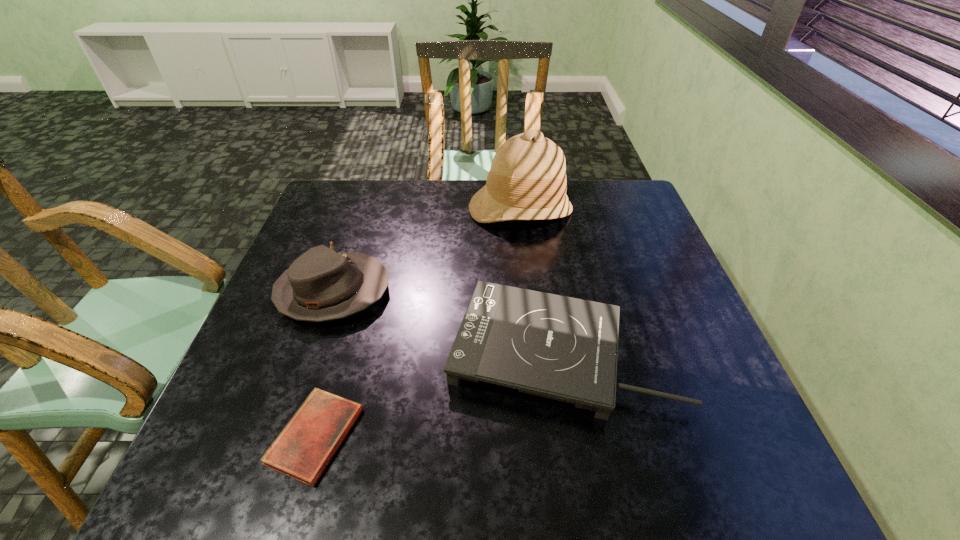
The height and width of the screenshot is (540, 960). I want to click on free space at the far left corner of the desktop, so click(x=345, y=204).

In order to click on free space at the far right corner of the desktop in this screenshot , I will do `click(627, 203)`.

Find the location of a particular element. The image size is (960, 540). vacant space at the near right corner of the desktop is located at coordinates (721, 455).

Where is `empty space that is in between the hotplate and the diary`? Image resolution: width=960 pixels, height=540 pixels. empty space that is in between the hotplate and the diary is located at coordinates (438, 394).

I want to click on free spot between the shortest object and the nearer hat, so click(x=324, y=364).

Locate an element on the screen. free space that is in between the tallest object and the shortest object is located at coordinates (419, 322).

The width and height of the screenshot is (960, 540). Identify the location of vacant space in between the second shortest object and the shortest object. (x=438, y=394).

Locate an element on the screen. The height and width of the screenshot is (540, 960). vacant point located between the shortest object and the left hat is located at coordinates (324, 364).

At what (x,y) coordinates should I click in order to perform the action: click on empty space that is in between the hotplate and the taller hat. Please return your answer as a coordinate pair (x, y). Image resolution: width=960 pixels, height=540 pixels. Looking at the image, I should click on (540, 280).

Locate an element on the screen. This screenshot has width=960, height=540. empty location between the diary and the taller hat is located at coordinates (419, 322).